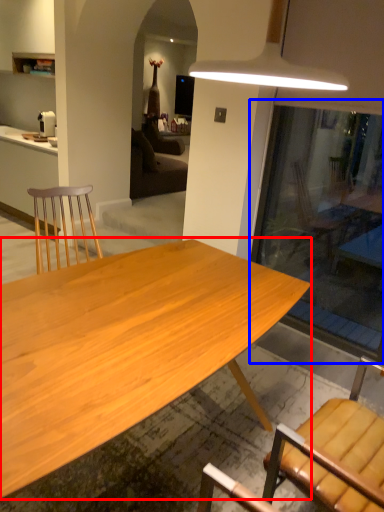
Question: Which point is further to the camera, desk (highlighted by a red box) or glass door (highlighted by a blue box)?

Choices:
 (A) desk
 (B) glass door

Answer: (B)